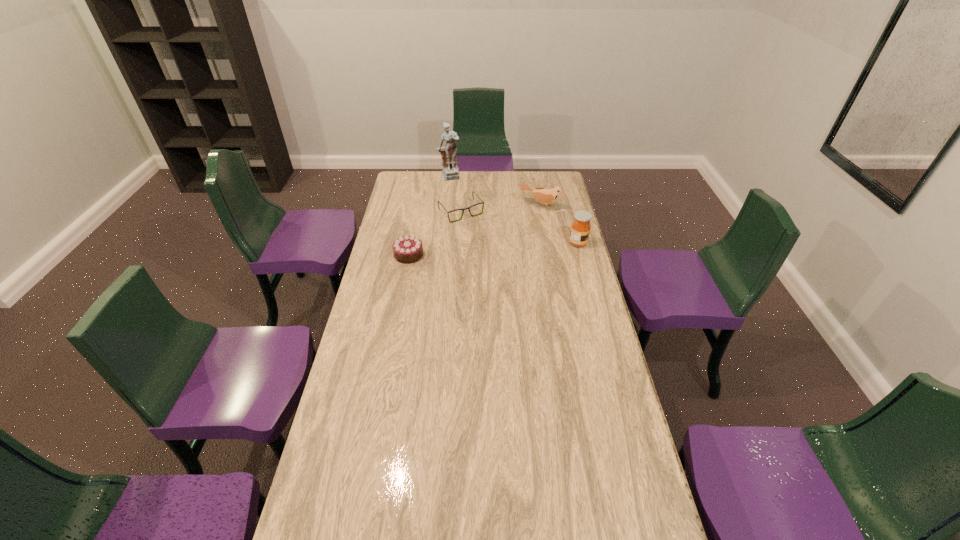
Locate an element on the screen. free space located 0.130m at the beak of the third tallest object is located at coordinates (524, 227).

Find the location of a particular element. This screenshot has height=540, width=960. vacant space located on the lens of the spectacles is located at coordinates (482, 235).

Image resolution: width=960 pixels, height=540 pixels. Find the location of `free space located on the lens of the spectacles`. free space located on the lens of the spectacles is located at coordinates click(505, 262).

I want to click on blank space located 0.220m on the lens of the spectacles, so click(x=493, y=248).

Locate an element on the screen. free space located on the front-facing side of the farthest object is located at coordinates (473, 218).

At what (x,y) coordinates should I click in order to perform the action: click on vacant space located 0.280m on the front-facing side of the farthest object. Please return your answer as a coordinate pair (x, y). This screenshot has height=540, width=960. Looking at the image, I should click on (468, 209).

Locate an element on the screen. The width and height of the screenshot is (960, 540). free space located on the front-facing side of the farthest object is located at coordinates (469, 211).

You are a GUI agent. You are given a task and a screenshot of the screen. Output one action in this format:
    pyautogui.click(x=<x>, y=<y>)
    Task: Click on the object that is at the far edge
    Image resolution: width=960 pixels, height=540 pixels.
    Given the screenshot: What is the action you would take?
    pyautogui.click(x=450, y=171)

Where is `object that is at the left edge`? object that is at the left edge is located at coordinates (408, 249).

Locate an element on the screen. Image resolution: width=960 pixels, height=540 pixels. honey at the right edge is located at coordinates (580, 229).